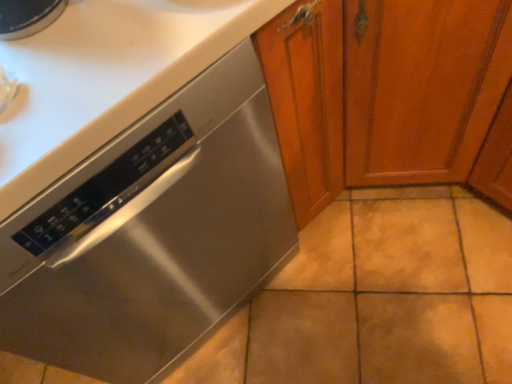
Question: Is stained wood cabinet at center turned away from stainless steel dishwasher at lower left?

Choices:
 (A) no
 (B) yes

Answer: (A)

Question: Is stained wood cabinet at center further to the viewer compared to stainless steel dishwasher at lower left?

Choices:
 (A) no
 (B) yes

Answer: (A)

Question: Is stained wood cabinet at center with stainless steel dishwasher at lower left?

Choices:
 (A) no
 (B) yes

Answer: (A)

Question: Is stained wood cabinet at center outside of stainless steel dishwasher at lower left?

Choices:
 (A) no
 (B) yes

Answer: (B)

Question: Is stained wood cabinet at center closer to camera compared to stainless steel dishwasher at lower left?

Choices:
 (A) no
 (B) yes

Answer: (B)

Question: From a real-world perspective, is stained wood cabinet at center located higher than stainless steel dishwasher at lower left?

Choices:
 (A) yes
 (B) no

Answer: (A)

Question: Is stainless steel dishwasher at lower left to the right of stained wood cabinet at center from the viewer's perspective?

Choices:
 (A) yes
 (B) no

Answer: (B)

Question: Is stainless steel dishwasher at lower left taller than stained wood cabinet at center?

Choices:
 (A) yes
 (B) no

Answer: (B)

Question: Does stainless steel dishwasher at lower left have a lesser height compared to stained wood cabinet at center?

Choices:
 (A) yes
 (B) no

Answer: (A)

Question: Is stainless steel dishwasher at lower left positioned in front of stained wood cabinet at center?

Choices:
 (A) yes
 (B) no

Answer: (B)

Question: Are stainless steel dishwasher at lower left and stained wood cabinet at center located far from each other?

Choices:
 (A) yes
 (B) no

Answer: (B)

Question: Can you confirm if stainless steel dishwasher at lower left is thinner than stained wood cabinet at center?

Choices:
 (A) yes
 (B) no

Answer: (A)

Question: From the image's perspective, relative to stainless steel dishwasher at lower left, is stained wood cabinet at center above or below?

Choices:
 (A) above
 (B) below

Answer: (A)